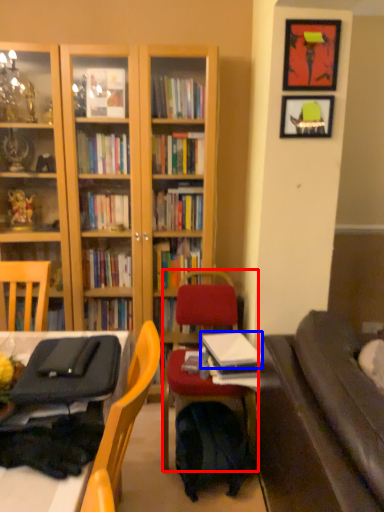
Question: Which point is further to the camera, chair (highlighted by a red box) or book (highlighted by a blue box)?

Choices:
 (A) chair
 (B) book

Answer: (B)